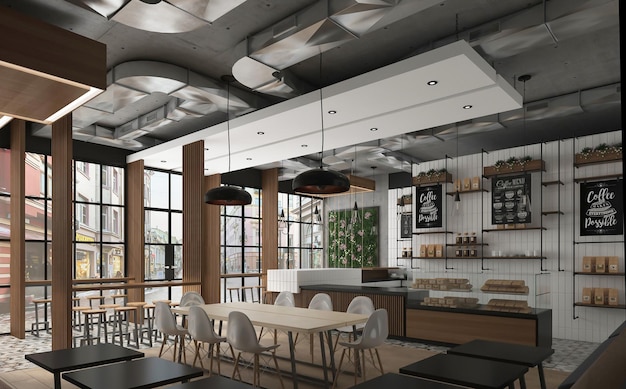
Locate an element on the screen. shelves is located at coordinates (406, 256), (431, 256), (468, 256), (469, 243), (470, 190), (506, 228), (513, 255), (583, 271), (588, 304).